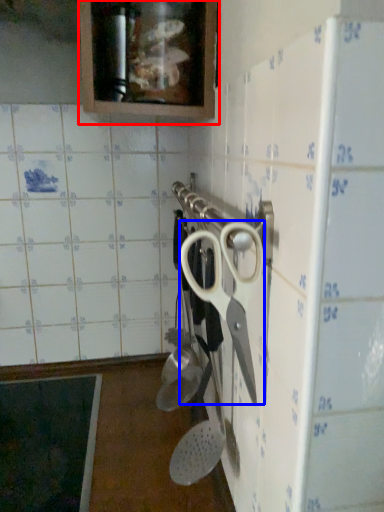
Question: Among these objects, which one is nearest to the camera, cabinetry (highlighted by a red box) or scissors (highlighted by a blue box)?

Choices:
 (A) cabinetry
 (B) scissors

Answer: (B)